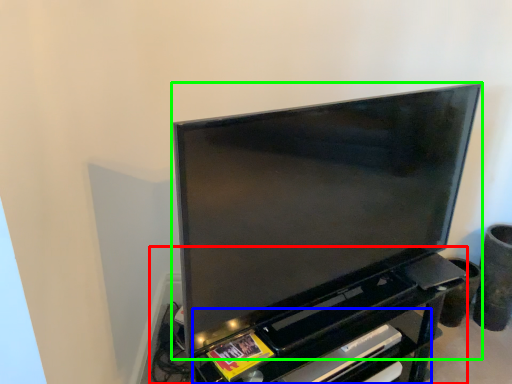
Question: Which is nearer to the entertainment center (highlighted by a red box)? shelf (highlighted by a blue box) or television (highlighted by a green box).

Choices:
 (A) shelf
 (B) television

Answer: (B)